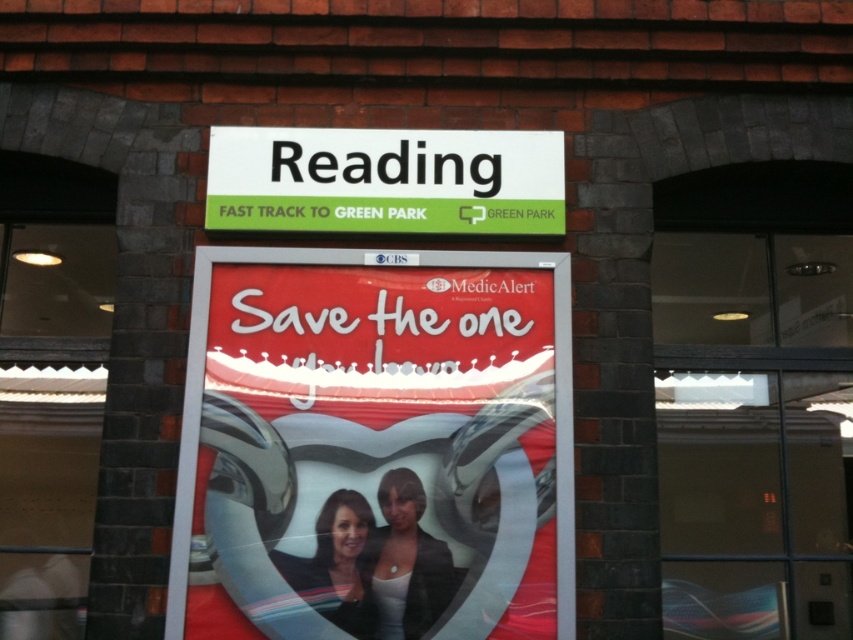
You are standing in front of a building and see the transparent glass door at center and the smooth black hair at center. Which object is bigger in size?

The transparent glass door at center is larger in size than smooth black hair at center.

You are standing in front of a brick building with a signboard and a poster. There is a point labeled at coordinates (375, 445). Which object does this point correspond to?

The point corresponds to the matte plastic poster at center.

You are standing 3 meters away from the brick building. You want to read the text on the matte plastic poster at center. Can you reach it without moving closer?

The matte plastic poster at center is 2.99 meters away from the camera, so you are only 1 centimeter away from the poster. Therefore, you can reach it without moving closer.